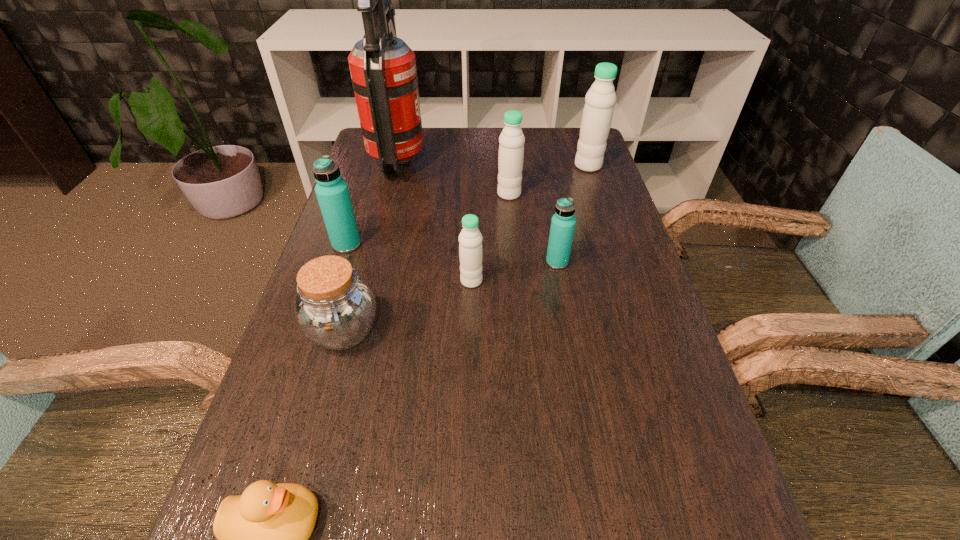
Locate an element on the screen. the second water bottle from left to right is located at coordinates (470, 239).

Where is `the nearest white water bottle`? The width and height of the screenshot is (960, 540). the nearest white water bottle is located at coordinates (470, 239).

Identify the location of brown jar. The image size is (960, 540). (334, 307).

Locate an element on the screen. The height and width of the screenshot is (540, 960). jar is located at coordinates tap(334, 307).

Identify the location of free space located on the front label side of the fire extinguisher. (484, 162).

Identify the location of vacant space positioned 0.320m on the left of the farthest white water bottle. Image resolution: width=960 pixels, height=540 pixels. (470, 166).

I want to click on vacant region located on the front of the left blue water bottle, so click(303, 379).

The height and width of the screenshot is (540, 960). Find the location of `vacant region located on the right of the second farthest white water bottle`. vacant region located on the right of the second farthest white water bottle is located at coordinates (553, 194).

Where is `free spot located 0.310m on the back of the fourth nearest object`? This screenshot has height=540, width=960. free spot located 0.310m on the back of the fourth nearest object is located at coordinates (542, 184).

At what (x,y) coordinates should I click in order to perform the action: click on free space located on the left of the fifth object from left to right. Please return your answer as a coordinate pair (x, y). Looking at the image, I should click on (386, 281).